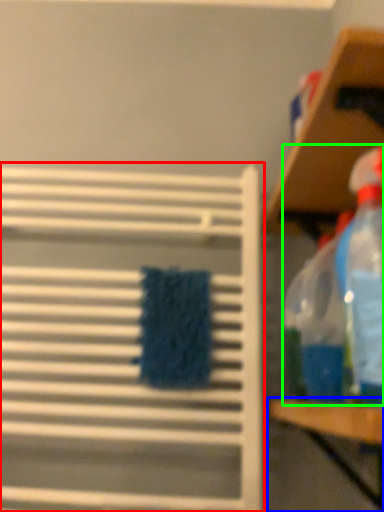
Question: Which object is positioned closest to shelf (highlighted by a red box)? Select from table (highlighted by a blue box) and cleaning product (highlighted by a green box).

Choices:
 (A) table
 (B) cleaning product

Answer: (B)